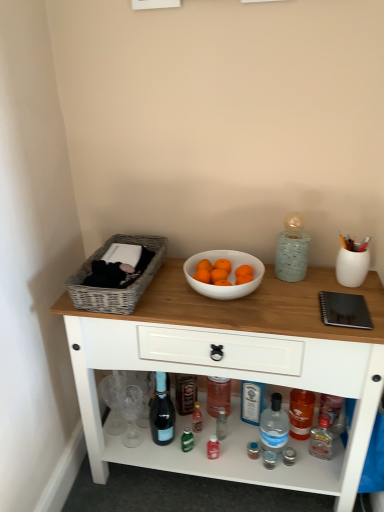
Where is `vacant region to the right of white glossy bowl at center`? vacant region to the right of white glossy bowl at center is located at coordinates [x=293, y=293].